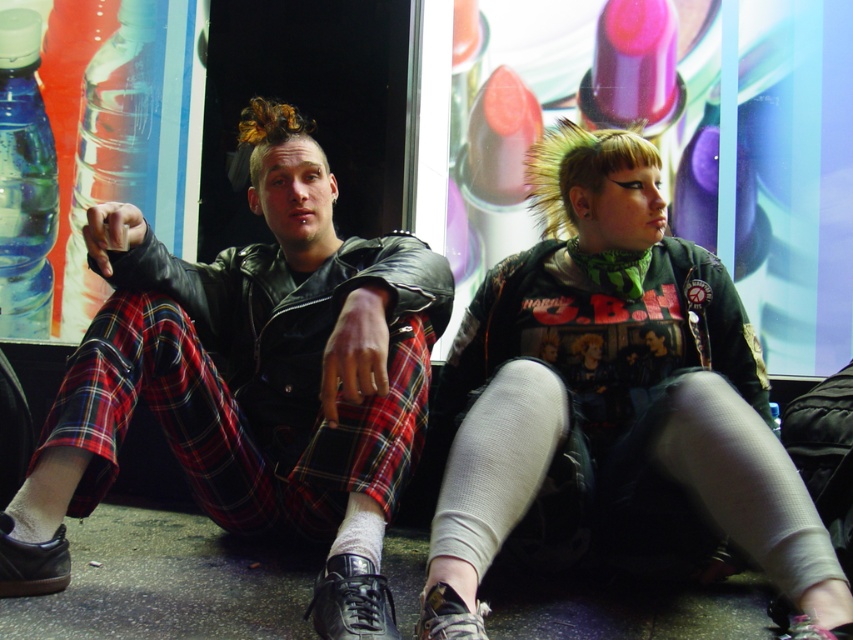
Question: Which point is farther from the camera taking this photo?

Choices:
 (A) (42, 330)
 (B) (483, 552)
 (C) (112, 467)
 (D) (107, 93)

Answer: (D)

Question: Based on their relative distances, which object is nearer to the transparent plastic bottle at left?

Choices:
 (A) clear plastic bottle at left
 (B) matte green t-shirt at center
 (C) leather jacket at center

Answer: (A)

Question: Is matte green t-shirt at center smaller than clear plastic bottle at left?

Choices:
 (A) no
 (B) yes

Answer: (A)

Question: Which is farther from the transparent plastic bottle at left?

Choices:
 (A) matte green t-shirt at center
 (B) clear plastic bottle at left

Answer: (A)

Question: Is leather jacket at center wider than matte green t-shirt at center?

Choices:
 (A) no
 (B) yes

Answer: (B)

Question: Considering the relative positions of leather jacket at center and transparent plastic bottle at left in the image provided, where is leather jacket at center located with respect to transparent plastic bottle at left?

Choices:
 (A) above
 (B) below

Answer: (B)